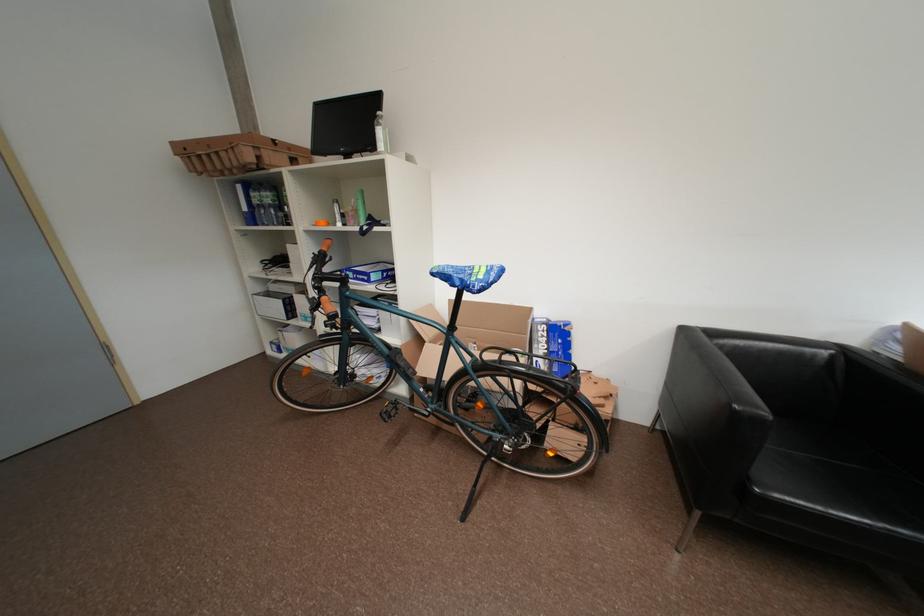
This screenshot has height=616, width=924. Identify the location of blue bicycle saddle. (468, 276).